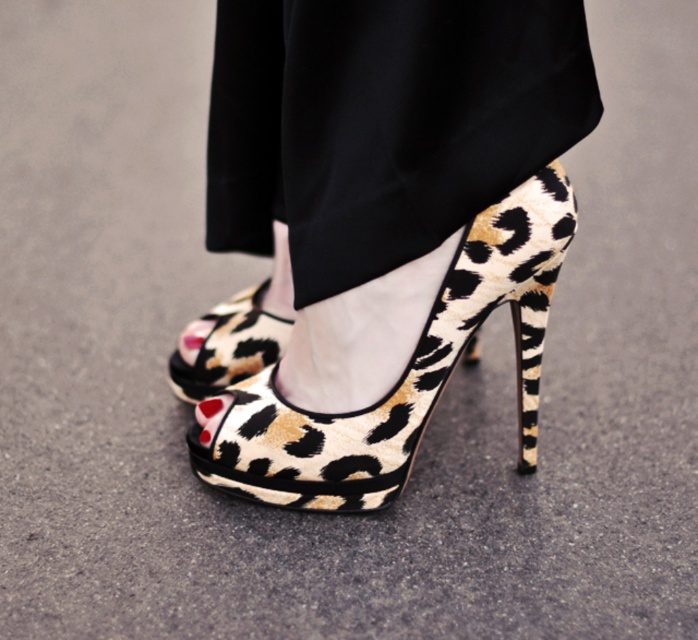
Question: Among these objects, which one is farthest from the camera?

Choices:
 (A) leopard print suede sandal at center
 (B) leopard print fabric high-heeled shoe at center

Answer: (B)

Question: Is leopard print suede sandal at center smaller than leopard print fabric high-heeled shoe at center?

Choices:
 (A) yes
 (B) no

Answer: (B)

Question: Where is leopard print suede sandal at center located in relation to leopard print fabric high-heeled shoe at center in the image?

Choices:
 (A) right
 (B) left

Answer: (A)

Question: Observing the image, what is the correct spatial positioning of leopard print suede sandal at center in reference to leopard print fabric high-heeled shoe at center?

Choices:
 (A) left
 (B) right

Answer: (B)

Question: Among these objects, which one is farthest from the camera?

Choices:
 (A) leopard print suede sandal at center
 (B) leopard print fabric high-heeled shoe at center

Answer: (B)

Question: Among these objects, which one is farthest from the camera?

Choices:
 (A) leopard print suede sandal at center
 (B) leopard print fabric high-heeled shoe at center

Answer: (B)